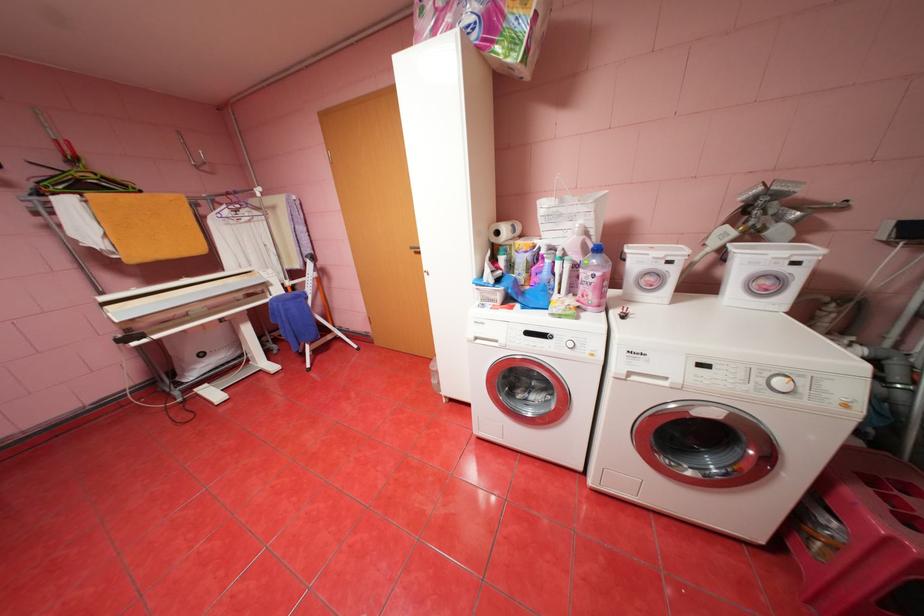
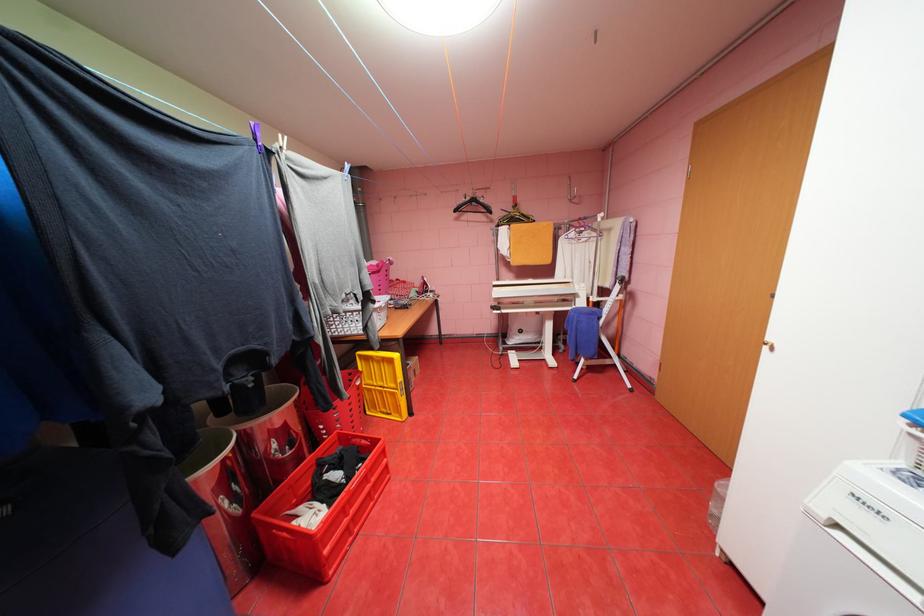
Find the pixel in the second image that matches [433,274] in the first image.

(774, 347)